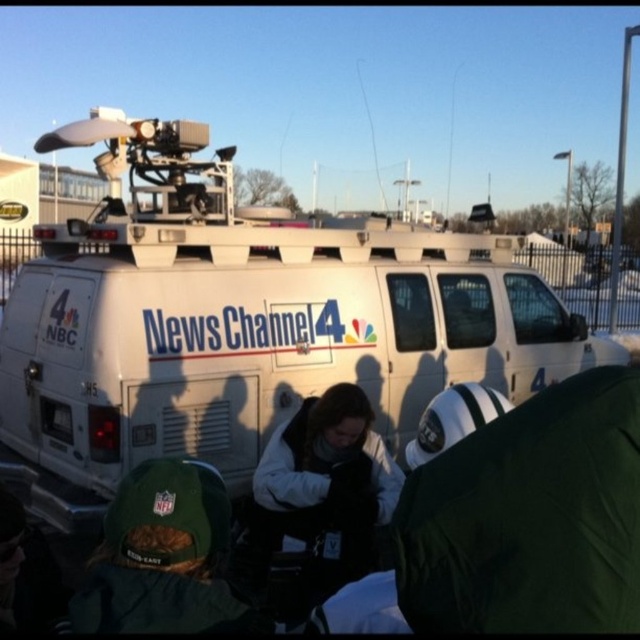
You are standing in front of the News Channel 4 van and want to take a photo of both the point at coordinates point [358,256] and point [132,588]. Which point should you focus on first to ensure both are in the frame?

You should focus on point [358,256] first because it is closer to you than point [132,588], ensuring both points are within the camera frame.

You are standing at the point marked by the coordinates point (x=529, y=516). Looking around, you see the news van from News Channel 4 with the NBC logo and several people in winter clothing. Which object is directly below you at this point?

The point (x=529, y=516) is on the green fabric jacket at lower right, so the object directly below you at this point is the green fabric jacket at lower right.

You are a photographer trying to capture a clear photo of the white van at center and the green fabric jacket at lower right. Since you want both subjects to be in focus, which one should you focus on first to ensure the other is also in focus due to their size difference?

The white van at center is much taller than the green fabric jacket at lower right, so focusing on the white van at center first will help ensure both are in focus because it is larger and farther away.